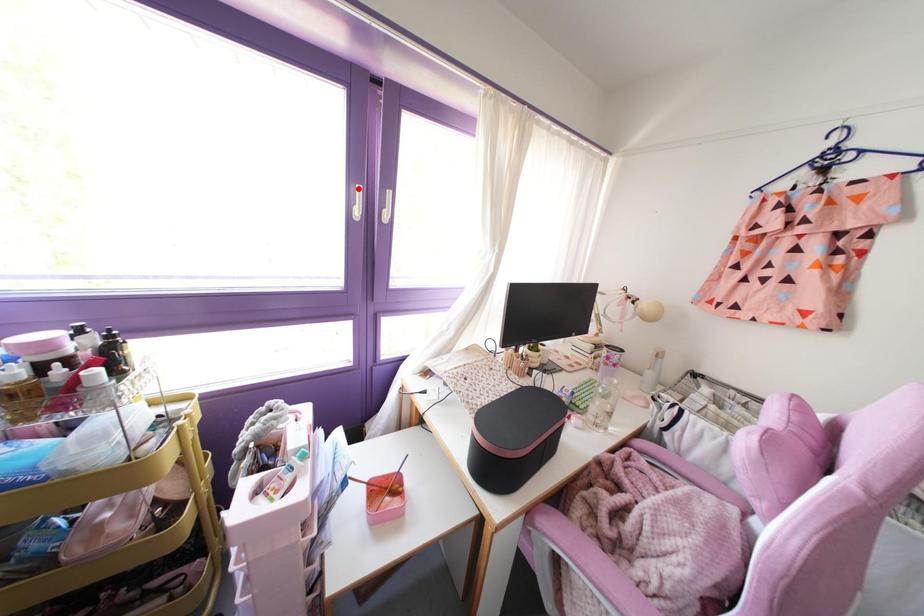
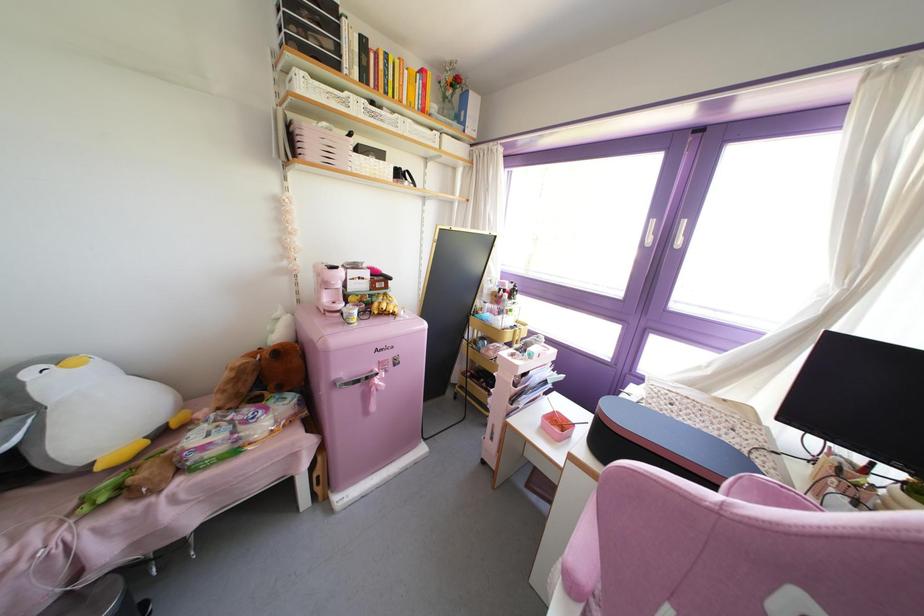
Where in the second image is the point corresponding to the highlighted location from the first image?

(652, 222)